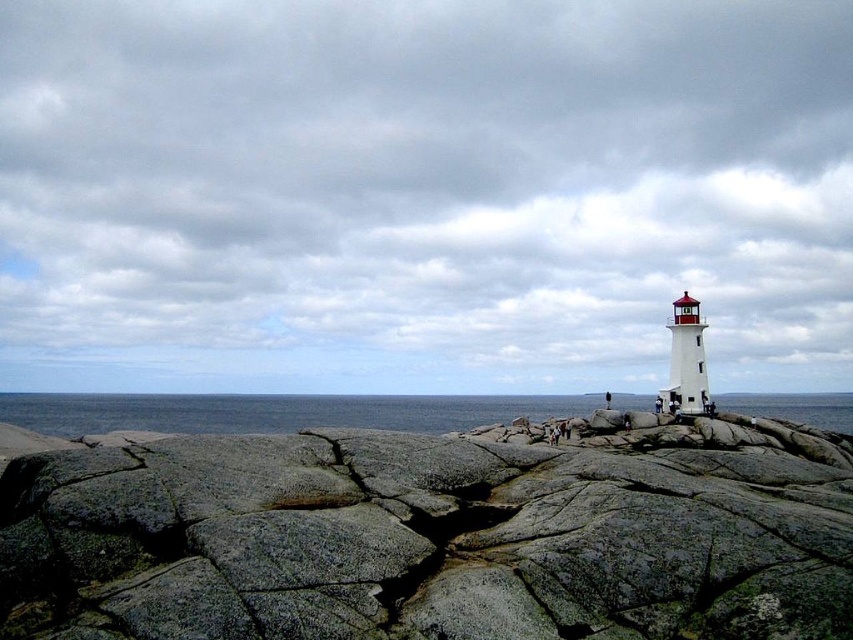
Is gray rock at center taller than blue water at center?

Incorrect, gray rock at center's height is not larger of blue water at center's.

Can you confirm if gray rock at center is shorter than blue water at center?

Indeed, gray rock at center has a lesser height compared to blue water at center.

What do you see at coordinates (428, 536) in the screenshot? I see `gray rock at center` at bounding box center [428, 536].

Locate an element on the screen. The width and height of the screenshot is (853, 640). gray rock at center is located at coordinates (428, 536).

Which is behind, point (376, 132) or point (792, 611)?

Positioned behind is point (376, 132).

Is white painted lighthouse at right to the left of gray rock at center from the viewer's perspective?

Correct, you'll find white painted lighthouse at right to the left of gray rock at center.

Measure the distance between white painted lighthouse at right and camera.

They are 52.63 meters apart.

At what (x,y) coordinates should I click in order to perform the action: click on white painted lighthouse at right. Please return your answer as a coordinate pair (x, y). Looking at the image, I should click on (422, 193).

Can you confirm if white painted lighthouse at right is bigger than blue water at center?

Indeed, white painted lighthouse at right has a larger size compared to blue water at center.

Can you confirm if white painted lighthouse at right is shorter than blue water at center?

No, white painted lighthouse at right is not shorter than blue water at center.

This screenshot has width=853, height=640. What do you see at coordinates (422, 193) in the screenshot?
I see `white painted lighthouse at right` at bounding box center [422, 193].

Locate an element on the screen. This screenshot has width=853, height=640. white painted lighthouse at right is located at coordinates pyautogui.click(x=422, y=193).